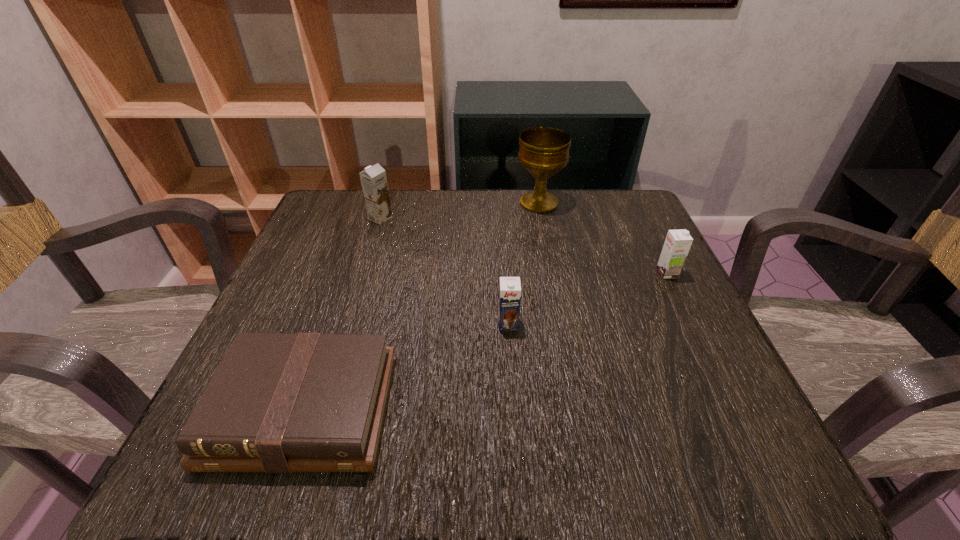
In order to click on free space located on the front of the tallest object in this screenshot , I will do pyautogui.click(x=545, y=235).

Where is `vacant region located on the right of the leftmost chocolate milk`? This screenshot has height=540, width=960. vacant region located on the right of the leftmost chocolate milk is located at coordinates (476, 218).

Locate an element on the screen. free space located on the left of the rightmost object is located at coordinates [472, 273].

Image resolution: width=960 pixels, height=540 pixels. Find the location of `free space located 0.110m on the front label of the third object from left to right`. free space located 0.110m on the front label of the third object from left to right is located at coordinates (512, 382).

Where is `chalice that is at the far edge`? chalice that is at the far edge is located at coordinates pos(544,151).

The height and width of the screenshot is (540, 960). Identify the location of chocolate milk present at the far edge. (373, 179).

At what (x,y) coordinates should I click in order to perform the action: click on object present at the near edge. Please return your answer as a coordinate pair (x, y). This screenshot has width=960, height=540. Looking at the image, I should click on (278, 402).

Where is `chocolate milk situated at the left edge`? The width and height of the screenshot is (960, 540). chocolate milk situated at the left edge is located at coordinates (373, 179).

Locate an element on the screen. Image resolution: width=960 pixels, height=540 pixels. Bible present at the left edge is located at coordinates [278, 402].

Identify the location of object that is at the right edge. The height and width of the screenshot is (540, 960). (678, 242).